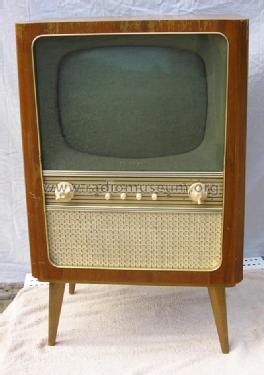
This screenshot has height=375, width=264. I want to click on right knob, so click(x=198, y=198).